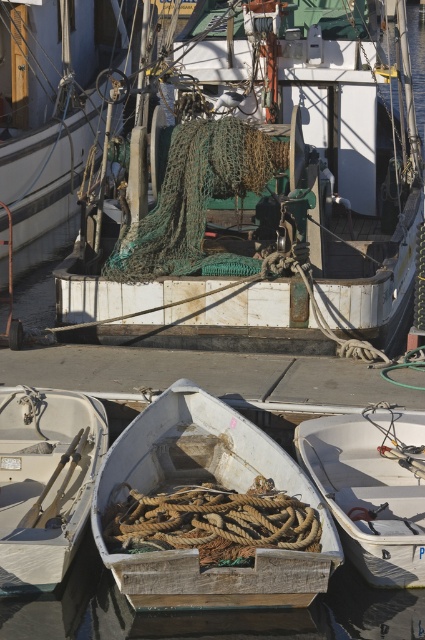
You are standing at the edge of the dock and see the green netting at center and the white matte boat at lower center. Which object is positioned higher relative to the other?

The green netting at center is located above the white matte boat at lower center, so it is positioned higher.